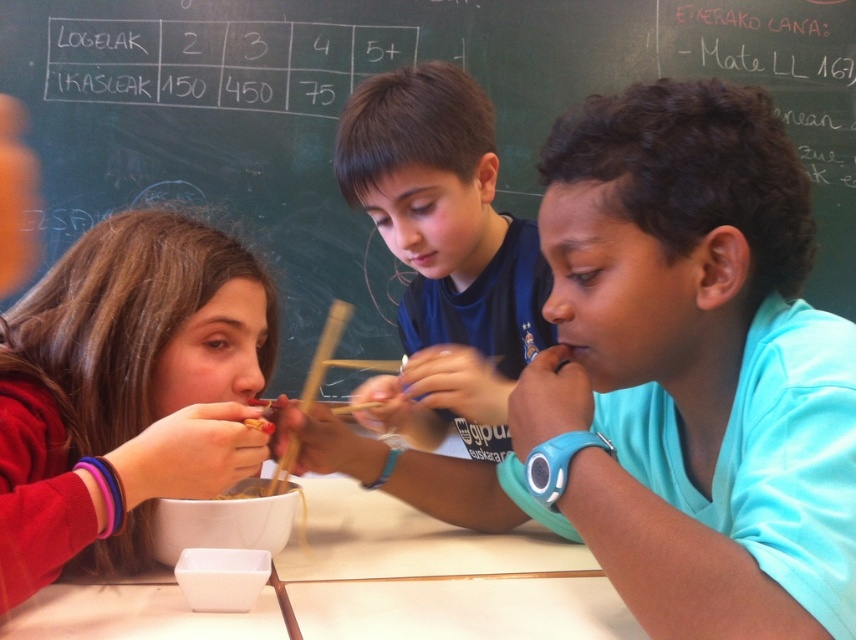
Who is taller, blue shirt at center or dark blue shirt at center?

dark blue shirt at center

Can you confirm if blue shirt at center is wider than dark blue shirt at center?

Yes, blue shirt at center is wider than dark blue shirt at center.

This screenshot has width=856, height=640. What do you see at coordinates (669, 378) in the screenshot?
I see `blue shirt at center` at bounding box center [669, 378].

The height and width of the screenshot is (640, 856). In order to click on blue shirt at center in this screenshot , I will do `click(669, 378)`.

What do you see at coordinates (669, 378) in the screenshot? I see `blue shirt at center` at bounding box center [669, 378].

Can you confirm if blue shirt at center is wider than black chalkboard at upper center?

No, blue shirt at center is not wider than black chalkboard at upper center.

Is point (685, 429) less distant than point (597, 52)?

That is True.

Where is `blue shirt at center`? blue shirt at center is located at coordinates (669, 378).

Which is below, blue shirt at center or matte red sweater at left?

blue shirt at center is below.

Is point (664, 602) more distant than point (134, 404)?

That is False.

Where is `blue shirt at center`? This screenshot has height=640, width=856. blue shirt at center is located at coordinates (669, 378).